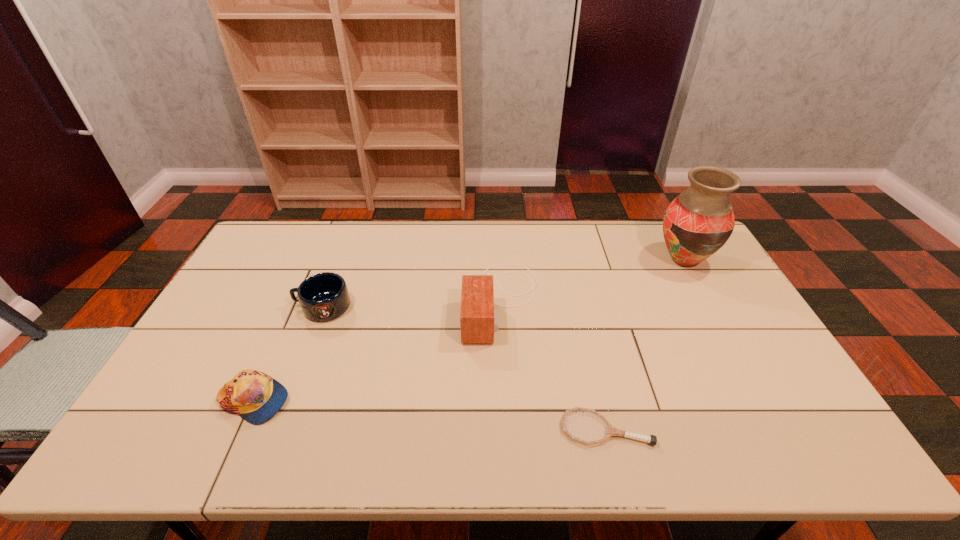
Locate an element on the screen. Image resolution: width=960 pixels, height=540 pixels. vacant area that satisfies the following two spatial constraints: 1. on the front side of the tallest object; 2. on the bill of the cap is located at coordinates (761, 401).

Identify the location of vacant space that satisfies the following two spatial constraints: 1. on the back side of the fourth object from left to right; 2. with the handle on the side of the mug. Image resolution: width=960 pixels, height=540 pixels. (577, 307).

Image resolution: width=960 pixels, height=540 pixels. Identify the location of free space that satisfies the following two spatial constraints: 1. on the back side of the vase; 2. on the left side of the shortest object. (566, 260).

You are a GUI agent. You are given a task and a screenshot of the screen. Output one action in this format:
    pyautogui.click(x=<x>, y=<y>)
    Task: Click on the vacant space that satisfies the following two spatial constraints: 1. on the front side of the tallest object; 2. on the bill of the cap
    
    Given the screenshot: What is the action you would take?
    pyautogui.click(x=761, y=401)

You are a GUI agent. You are given a task and a screenshot of the screen. Output one action in this format:
    pyautogui.click(x=<x>, y=<y>)
    Task: Click on the free space that satisfies the following two spatial constraints: 1. on the bill of the tennis racket; 2. on the left side of the cap
    
    Given the screenshot: What is the action you would take?
    pyautogui.click(x=242, y=428)

Where is `vacant area in the image that satisfies the following two spatial constraints: 1. on the front-facing side of the third object from right to left; 2. on the right side of the second object from right to left`? Image resolution: width=960 pixels, height=540 pixels. vacant area in the image that satisfies the following two spatial constraints: 1. on the front-facing side of the third object from right to left; 2. on the right side of the second object from right to left is located at coordinates (508, 428).

Image resolution: width=960 pixels, height=540 pixels. I want to click on blank area in the image that satisfies the following two spatial constraints: 1. with the handle on the side of the mug; 2. on the left side of the second object from right to left, so click(276, 428).

Identify the location of vacant space that satisfies the following two spatial constraints: 1. on the back side of the shortest object; 2. on the front-facing side of the third object from left to right. The width and height of the screenshot is (960, 540). (576, 301).